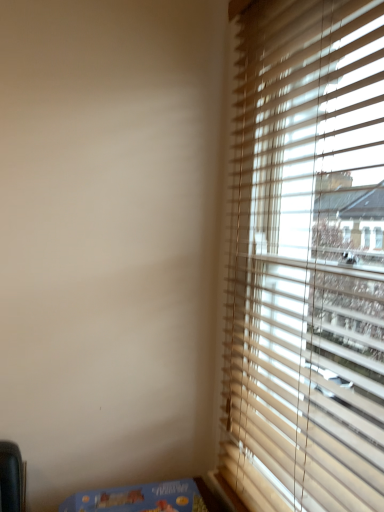
Question: From the image's perspective, is wooden blinds at right located beneath blue cardboard box at lower left?

Choices:
 (A) yes
 (B) no

Answer: (B)

Question: Is wooden blinds at right positioned with its back to blue cardboard box at lower left?

Choices:
 (A) no
 (B) yes

Answer: (A)

Question: From the image's perspective, is wooden blinds at right on blue cardboard box at lower left?

Choices:
 (A) no
 (B) yes

Answer: (B)

Question: Considering the relative sizes of wooden blinds at right and blue cardboard box at lower left in the image provided, is wooden blinds at right bigger than blue cardboard box at lower left?

Choices:
 (A) no
 (B) yes

Answer: (B)

Question: Does wooden blinds at right lie behind blue cardboard box at lower left?

Choices:
 (A) yes
 (B) no

Answer: (B)

Question: From a real-world perspective, is wooden blinds at right under blue cardboard box at lower left?

Choices:
 (A) no
 (B) yes

Answer: (A)

Question: Is blue cardboard box at lower left positioned beyond the bounds of wooden blinds at right?

Choices:
 (A) yes
 (B) no

Answer: (A)

Question: Does blue cardboard box at lower left have a greater height compared to wooden blinds at right?

Choices:
 (A) no
 (B) yes

Answer: (A)

Question: Considering the relative positions of blue cardboard box at lower left and wooden blinds at right in the image provided, is blue cardboard box at lower left in front of wooden blinds at right?

Choices:
 (A) no
 (B) yes

Answer: (A)

Question: From a real-world perspective, is blue cardboard box at lower left on wooden blinds at right?

Choices:
 (A) yes
 (B) no

Answer: (B)

Question: Considering the relative sizes of blue cardboard box at lower left and wooden blinds at right in the image provided, is blue cardboard box at lower left wider than wooden blinds at right?

Choices:
 (A) yes
 (B) no

Answer: (A)

Question: Does blue cardboard box at lower left have a lesser width compared to wooden blinds at right?

Choices:
 (A) yes
 (B) no

Answer: (B)

Question: Considering the positions of blue cardboard box at lower left and wooden blinds at right in the image, is blue cardboard box at lower left bigger or smaller than wooden blinds at right?

Choices:
 (A) big
 (B) small

Answer: (B)